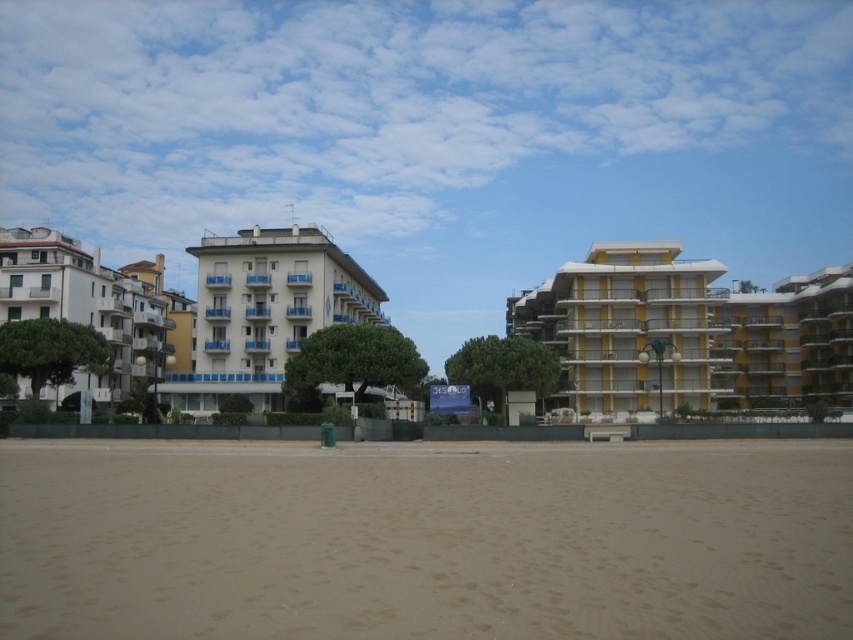
You are a photographer planning to capture a sunset shot with both the brown sandy beach at lower center and the white glossy building at center in the frame. Which object will occupy more space in the photo?

The white glossy building at center will occupy more space in the photo because the brown sandy beach at lower center is smaller than the white glossy building at center.

You are standing on the brown sandy beach at lower center and want to reach the white glossy building at center. Which direction should you move towards?

You should move upwards towards the white glossy building at center since the brown sandy beach at lower center is below it.